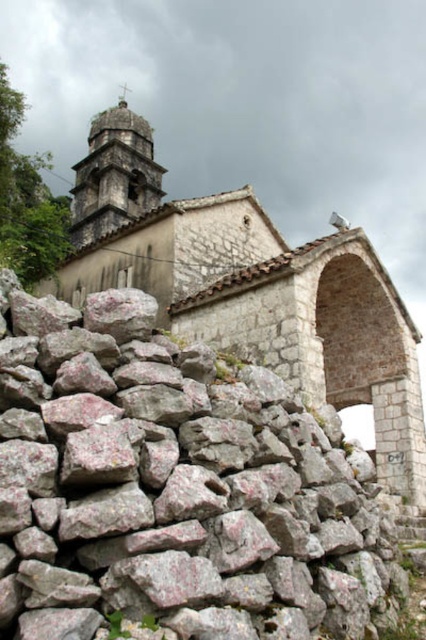
Does pinkish-gray rough stone at center come in front of light beige stone church at upper center?

Yes, pinkish-gray rough stone at center is in front of light beige stone church at upper center.

You are a GUI agent. You are given a task and a screenshot of the screen. Output one action in this format:
    pyautogui.click(x=<x>, y=<y>)
    Task: Click on the pinkish-gray rough stone at center
    The height and width of the screenshot is (640, 426).
    Given the screenshot: What is the action you would take?
    pyautogui.click(x=173, y=486)

Between light beige stone church at upper center and stone tower at upper center, which one appears on the left side from the viewer's perspective?

From the viewer's perspective, stone tower at upper center appears more on the left side.

Does light beige stone church at upper center appear over stone tower at upper center?

Actually, light beige stone church at upper center is below stone tower at upper center.

At what (x,y) coordinates should I click in order to perform the action: click on light beige stone church at upper center. Please return your answer as a coordinate pair (x, y). The image size is (426, 640). Looking at the image, I should click on (252, 291).

Who is shorter, pinkish-gray rough stone at center or stone tower at upper center?

With less height is pinkish-gray rough stone at center.

Can you confirm if pinkish-gray rough stone at center is shorter than stone tower at upper center?

Yes, pinkish-gray rough stone at center is shorter than stone tower at upper center.

Which is in front, point (250, 442) or point (138, 157)?

Point (250, 442) is in front.

The height and width of the screenshot is (640, 426). What are the coordinates of `pinkish-gray rough stone at center` in the screenshot? It's located at (173, 486).